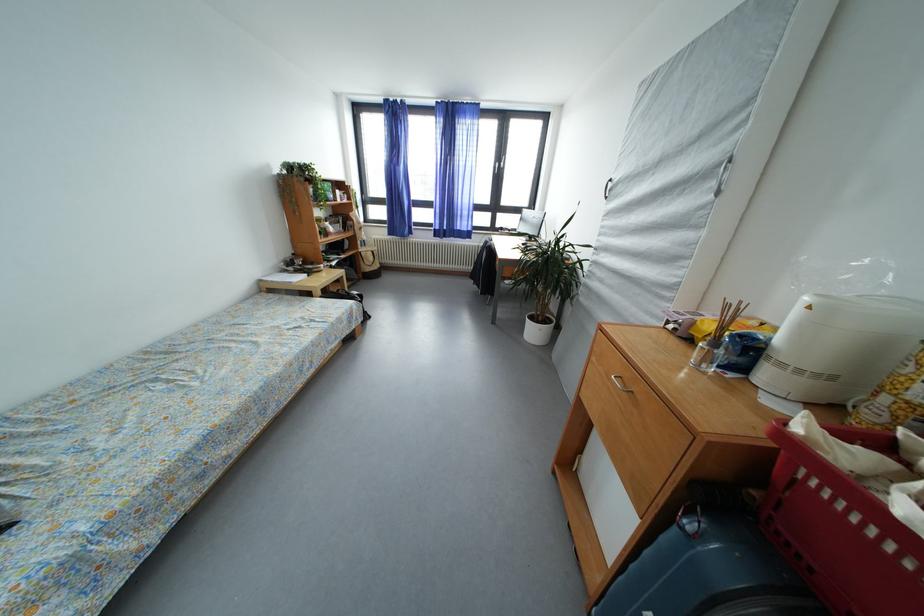
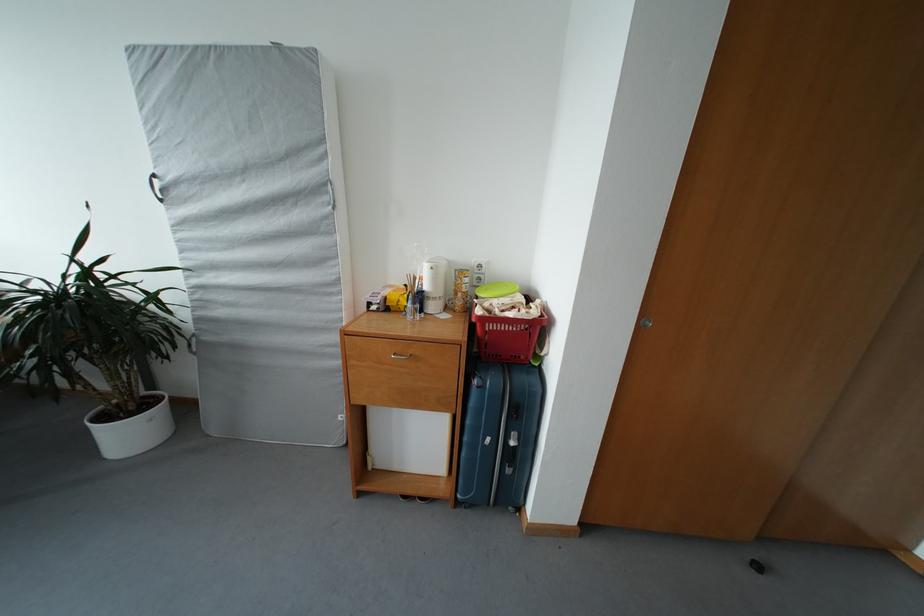
In the second image, find the point that corresponds to point (787, 370) in the first image.

(441, 304)